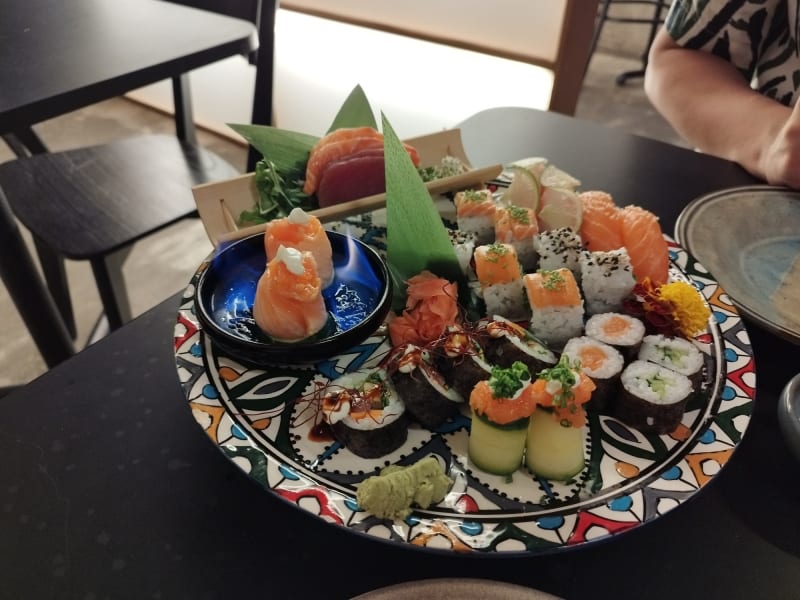
Where is `floor`? floor is located at coordinates (14, 356).